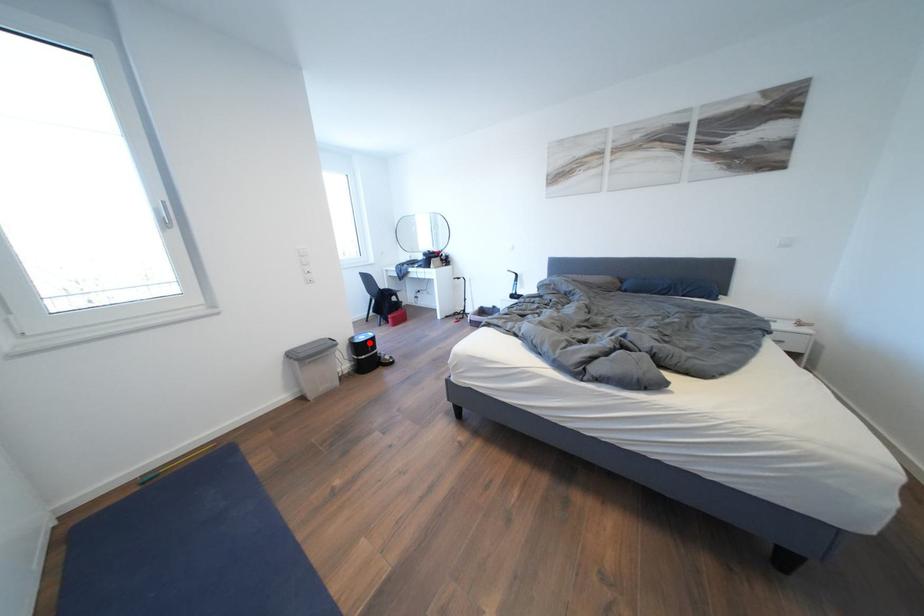
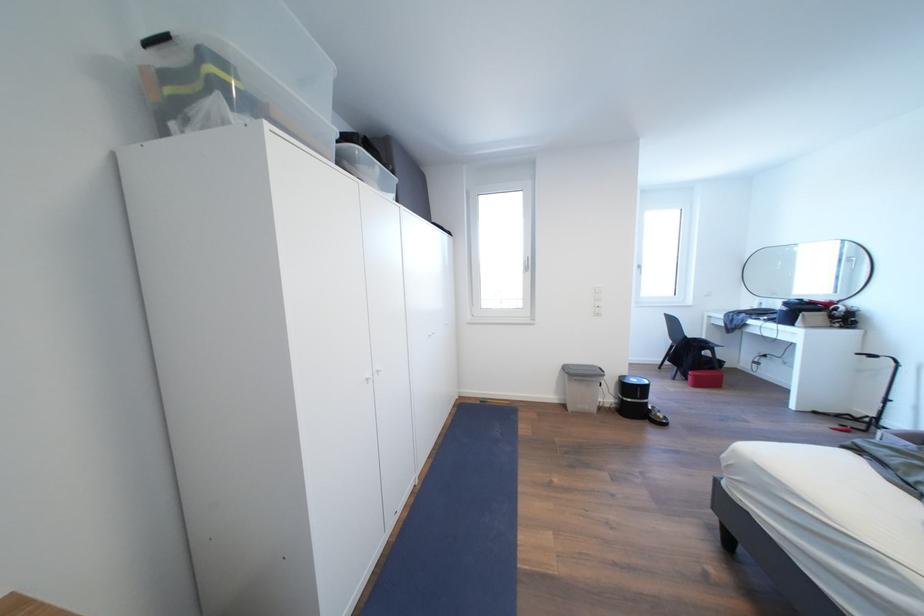
Question: I am providing you with two images of the same scene from different viewpoints. Image1 has a red point marked. In image2, the corresponding 3D location appears at what relative position? Reply with the corresponding letter.

Choices:
 (A) Closer
 (B) Farther

Answer: (B)